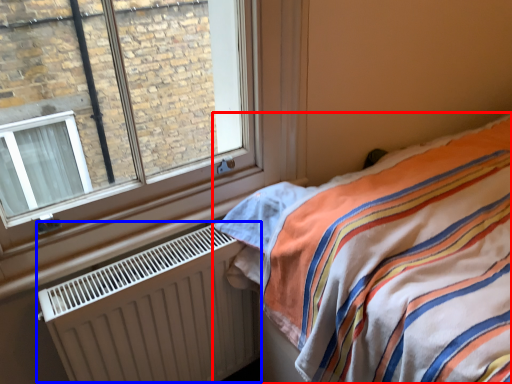
Question: Which object appears farthest to the camera in this image, bed (highlighted by a red box) or radiator (highlighted by a blue box)?

Choices:
 (A) bed
 (B) radiator

Answer: (B)